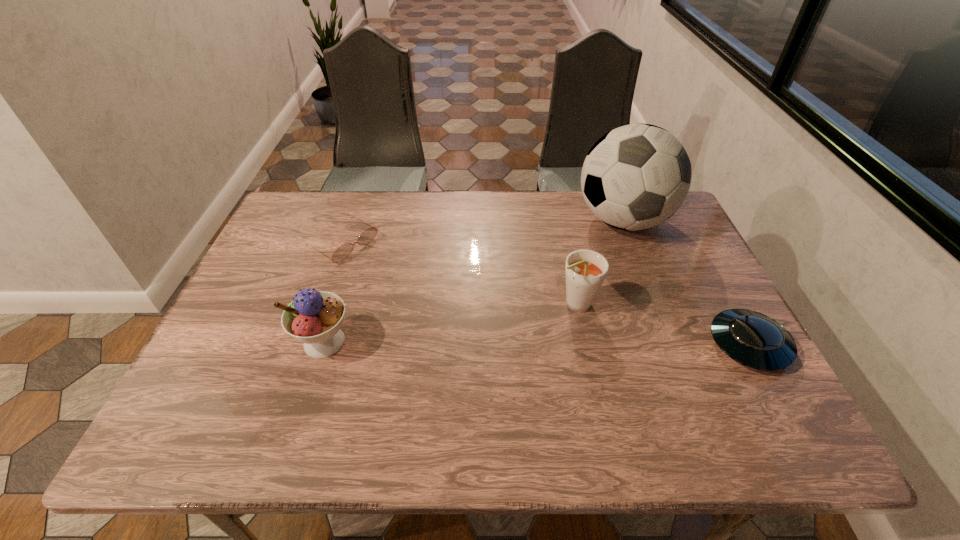
Locate which object ranks fourth in proximity to the icecream. Please provide its 2D coordinates. Your answer should be formatted as a tuple, i.e. [(x, y)], where the tuple contains the x and y coordinates of a point satisfying the conditions above.

[(755, 340)]

Locate which object ranks in proximity to the icecream. Please provide its 2D coordinates. Your answer should be formatted as a tuple, i.e. [(x, y)], where the tuple contains the x and y coordinates of a point satisfying the conditions above.

[(341, 253)]

Where is `vacant area that satisfies the following two spatial constraints: 1. on the back side of the icecream; 2. on the left side of the root beer`? Image resolution: width=960 pixels, height=540 pixels. vacant area that satisfies the following two spatial constraints: 1. on the back side of the icecream; 2. on the left side of the root beer is located at coordinates (336, 305).

Find the location of a particular element. Image resolution: width=960 pixels, height=540 pixels. free space in the image that satisfies the following two spatial constraints: 1. on the back side of the sunglasses; 2. on the right side of the soccer ball is located at coordinates (351, 220).